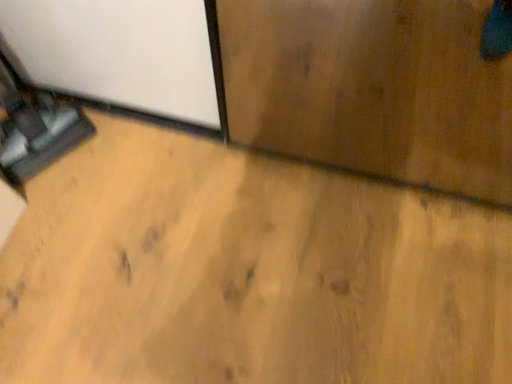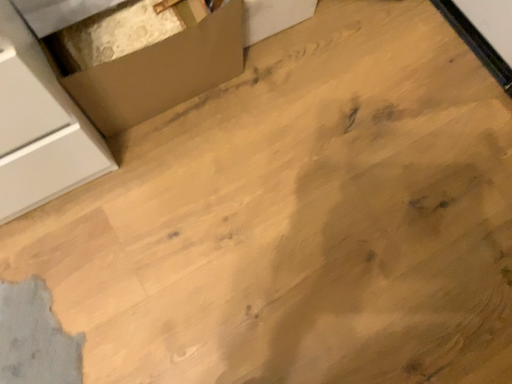
Question: Which way did the camera rotate in the video?

Choices:
 (A) rotated left
 (B) rotated right

Answer: (A)